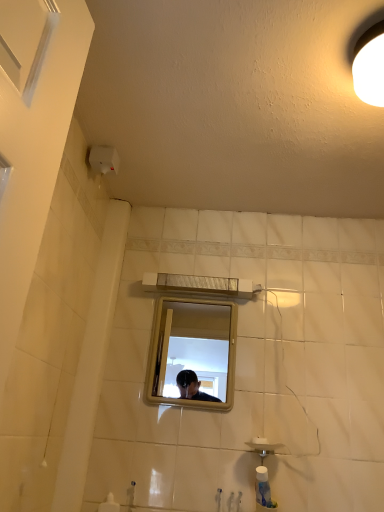
Question: Does metallic rectangular mirror at center turn towards white matte light fixture at upper right?

Choices:
 (A) yes
 (B) no

Answer: (A)

Question: Can you confirm if metallic rectangular mirror at center is positioned to the right of white matte light fixture at upper right?

Choices:
 (A) yes
 (B) no

Answer: (B)

Question: From a real-world perspective, is metallic rectangular mirror at center on top of white matte light fixture at upper right?

Choices:
 (A) no
 (B) yes

Answer: (A)

Question: Is metallic rectangular mirror at center positioned before white matte light fixture at upper right?

Choices:
 (A) no
 (B) yes

Answer: (A)

Question: Is metallic rectangular mirror at center thinner than white matte light fixture at upper right?

Choices:
 (A) no
 (B) yes

Answer: (B)

Question: Considering the positions of matte silver faucet at lower center and metallic rectangular mirror at center in the image, is matte silver faucet at lower center bigger or smaller than metallic rectangular mirror at center?

Choices:
 (A) small
 (B) big

Answer: (A)

Question: Looking at their shapes, would you say matte silver faucet at lower center is wider or thinner than metallic rectangular mirror at center?

Choices:
 (A) wide
 (B) thin

Answer: (A)

Question: Considering the relative positions of matte silver faucet at lower center and metallic rectangular mirror at center in the image provided, is matte silver faucet at lower center to the left or to the right of metallic rectangular mirror at center?

Choices:
 (A) right
 (B) left

Answer: (B)

Question: From the image's perspective, is matte silver faucet at lower center located above or below metallic rectangular mirror at center?

Choices:
 (A) below
 (B) above

Answer: (A)

Question: From their relative heights in the image, would you say metallic rectangular mirror at center is taller or shorter than white matte light fixture at upper right?

Choices:
 (A) short
 (B) tall

Answer: (B)

Question: Considering the positions of point (170, 333) and point (369, 34), is point (170, 333) closer or farther from the camera than point (369, 34)?

Choices:
 (A) farther
 (B) closer

Answer: (A)

Question: Relative to white matte light fixture at upper right, is metallic rectangular mirror at center in front or behind?

Choices:
 (A) behind
 (B) front

Answer: (A)

Question: In terms of width, does metallic rectangular mirror at center look wider or thinner when compared to white matte light fixture at upper right?

Choices:
 (A) thin
 (B) wide

Answer: (A)

Question: Is point (168, 323) positioned closer to the camera than point (129, 488)?

Choices:
 (A) closer
 (B) farther

Answer: (B)

Question: Looking at the image, does metallic rectangular mirror at center seem bigger or smaller compared to matte silver faucet at lower center?

Choices:
 (A) big
 (B) small

Answer: (A)